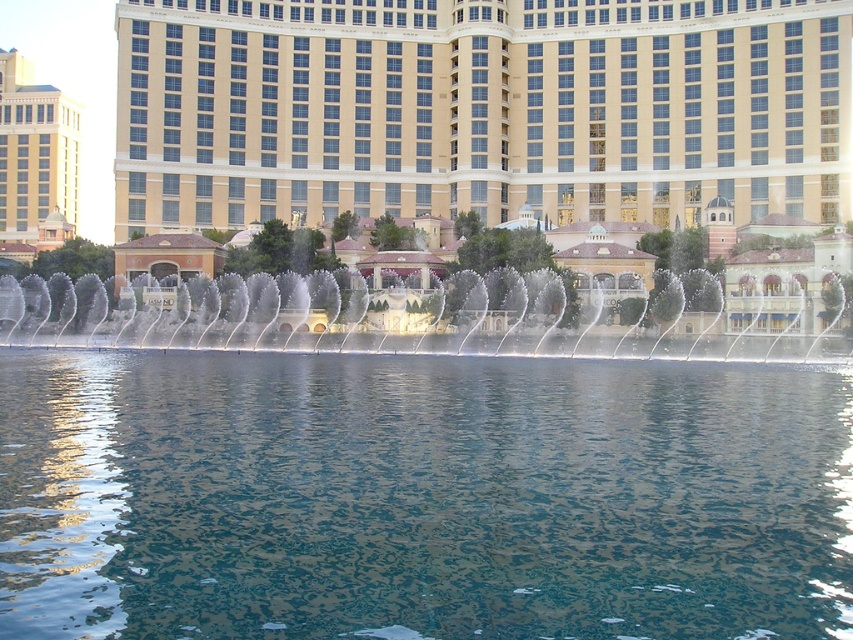
Consider the image. You are standing at the point labeled point (57, 93) and want to walk to the point labeled point (654, 349). Based on the scene description, which direction should you move to reach your destination?

To reach point (654, 349) from point (57, 93), you should move forward since point (654, 349) is in front of point (57, 93).

You are a photographer standing in front of the beige stone building at left and the clear water jets at center. You want to capture a photo that includes both objects. Which object will appear taller in the photo?

The beige stone building at left will appear taller in the photo because it is taller than the clear water jets at center according to the description.